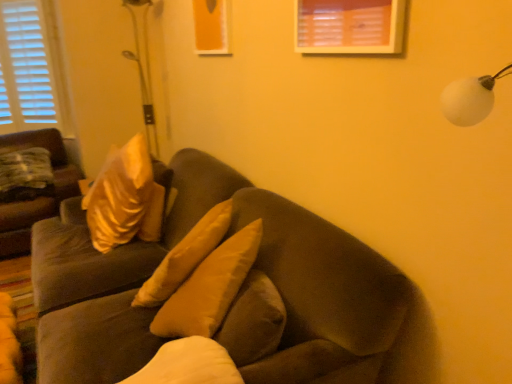
Question: Is suede brown couch at center, the first studio couch viewed from the right, to the left or to the right of suede-like brown couch at left, the 2th studio couch in the right-to-left sequence, in the image?

Choices:
 (A) left
 (B) right

Answer: (B)

Question: Based on their sizes in the image, would you say suede brown couch at center, the first studio couch viewed from the right, is bigger or smaller than suede-like brown couch at left, which is the second studio couch from front to back?

Choices:
 (A) big
 (B) small

Answer: (A)

Question: Which object is positioned farthest from the suede-like brown couch at left, which is counted as the 1th studio couch, starting from the back?

Choices:
 (A) suede brown couch at center, acting as the second studio couch starting from the left
 (B) satin gold pillow at left
 (C) metallic silver golf club at upper left

Answer: (A)

Question: Which of these objects is positioned closest to the suede-like brown couch at left, the 2th studio couch in the right-to-left sequence?

Choices:
 (A) suede brown couch at center, acting as the second studio couch starting from the left
 (B) satin gold pillow at left
 (C) metallic silver golf club at upper left

Answer: (B)